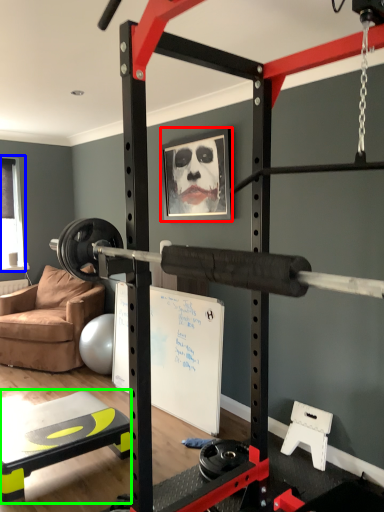
Question: Which is nearer to the picture frame (highlighted by a red box)? window screen (highlighted by a blue box) or table (highlighted by a green box).

Choices:
 (A) window screen
 (B) table

Answer: (B)